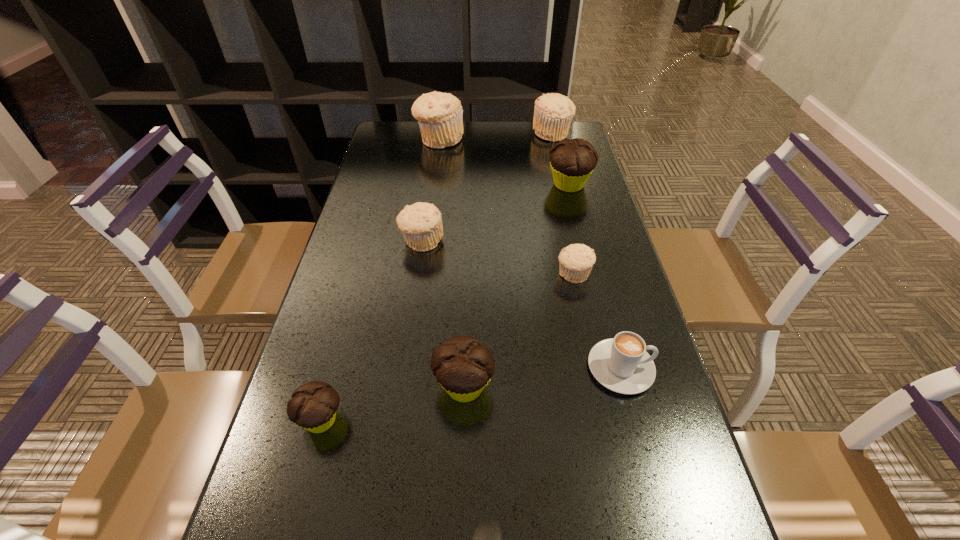
The image size is (960, 540). Identify the location of cappuccino located in the right edge section of the desktop. (621, 364).

This screenshot has width=960, height=540. I want to click on object at the far left corner, so click(440, 116).

Identify the location of object at the far right corner. The image size is (960, 540). (553, 113).

Locate an element on the screen. The width and height of the screenshot is (960, 540). vacant space at the far edge of the desktop is located at coordinates (505, 150).

Where is `vacant area at the left edge of the desktop`? vacant area at the left edge of the desktop is located at coordinates (392, 248).

Identify the location of blank space at the right edge of the desktop. (580, 323).

Locate an element on the screen. The width and height of the screenshot is (960, 540). blank space at the far left corner of the desktop is located at coordinates [x=396, y=131].

Locate an element on the screen. free space between the second biggest beige muffin and the smallest chocolate muffin is located at coordinates click(437, 276).

The height and width of the screenshot is (540, 960). In order to click on unoccupied position between the farthest chocolate muffin and the nearest beige muffin in this screenshot , I will do `click(571, 230)`.

I want to click on free spot between the sixth nearest object and the tallest muffin, so click(x=430, y=191).